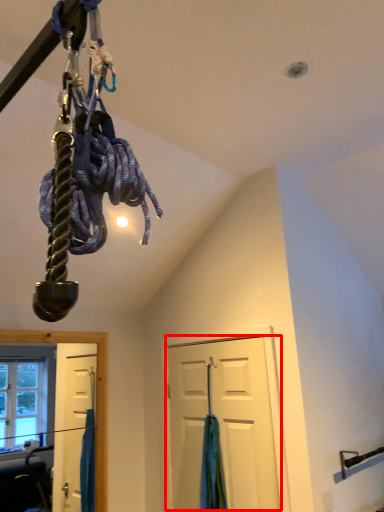
Question: From the image's perspective, considering the relative positions of door (annotated by the red box) and curtain in the image provided, where is door (annotated by the red box) located with respect to the staircase?

Choices:
 (A) above
 (B) below

Answer: (A)